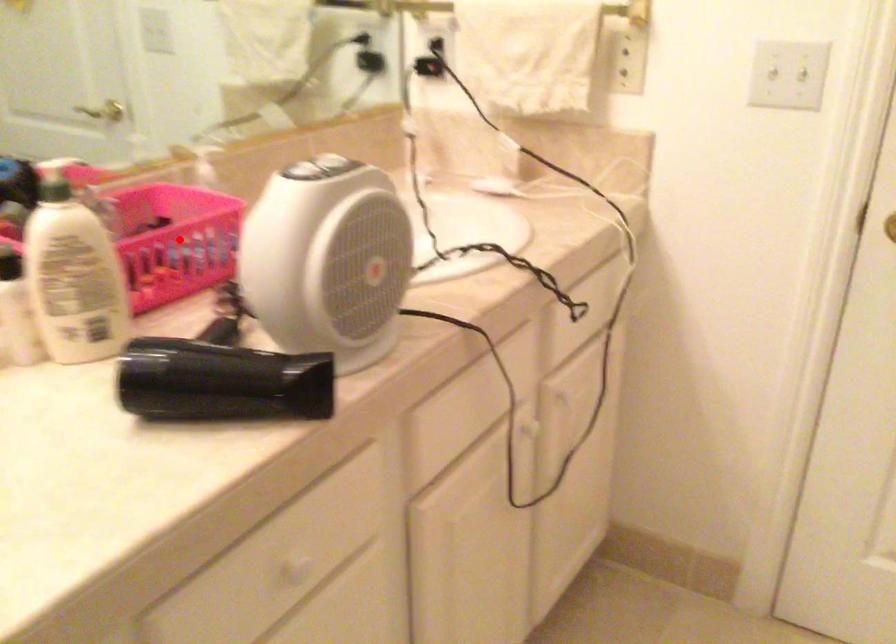
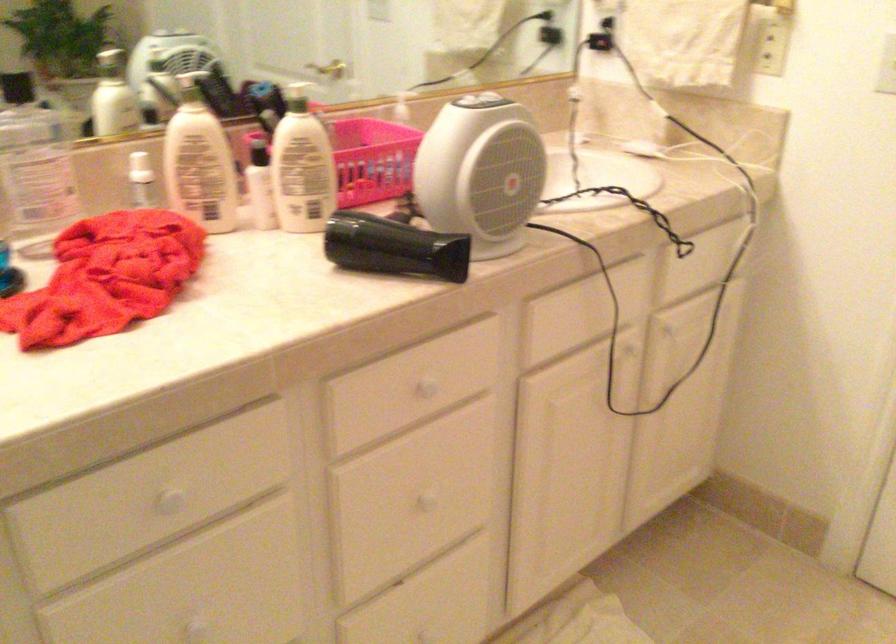
Question: I am providing you with two images of the same scene from different viewpoints. In image1, a red point is highlighted. Considering the same 3D point in image2, which of the following is correct?

Choices:
 (A) It is closer
 (B) It is farther

Answer: (B)